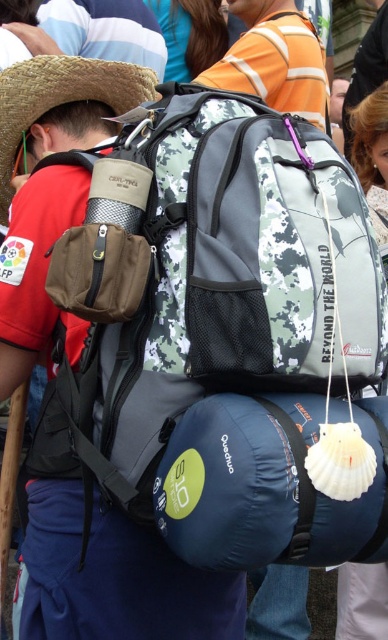
Question: Estimate the real-world distances between objects in this image. Which object is farther from the blue synthetic sleeping bag at lower center?

Choices:
 (A) straw hat at upper left
 (B) dark brown leather jacket at upper center

Answer: (B)

Question: Which object appears closest to the camera in this image?

Choices:
 (A) blue synthetic sleeping bag at lower center
 (B) dark brown leather jacket at upper center
 (C) camouflage backpack at center

Answer: (A)

Question: In this image, where is camouflage backpack at center located relative to dark brown leather jacket at upper center?

Choices:
 (A) below
 (B) above

Answer: (A)

Question: Is camouflage backpack at center positioned in front of dark brown leather jacket at upper center?

Choices:
 (A) yes
 (B) no

Answer: (A)

Question: Does camouflage backpack at center appear on the right side of straw hat at upper left?

Choices:
 (A) yes
 (B) no

Answer: (A)

Question: Which of the following is the closest to the observer?

Choices:
 (A) straw hat at upper left
 (B) camouflage backpack at center
 (C) dark brown leather jacket at upper center
 (D) blue synthetic sleeping bag at lower center

Answer: (D)